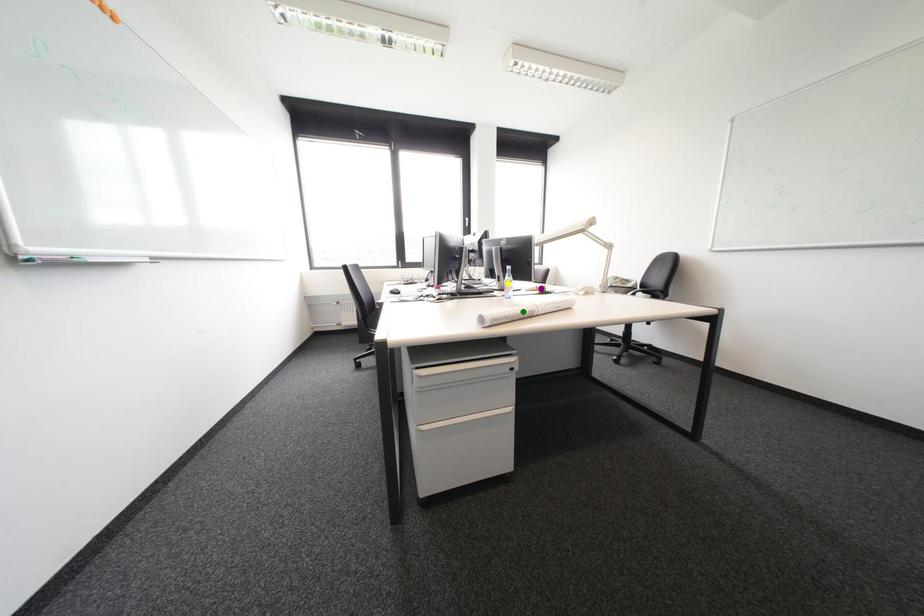
Order these from nearest to farthest:
- green point
- purple point
- yellow point

green point, purple point, yellow point